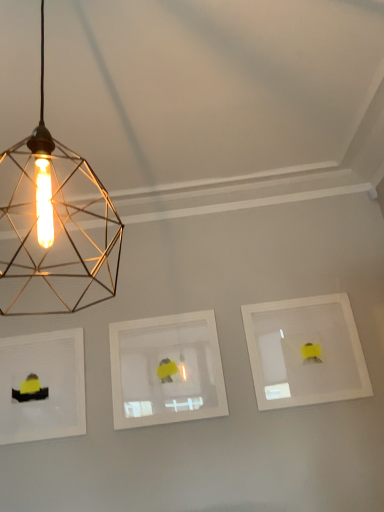
Question: In which direction should I rotate to look at white matte picture frame at center, the second picture frame in the right-to-left sequence?

Choices:
 (A) right
 (B) left

Answer: (B)

Question: Can white matte picture frame at center, the 2th picture frame in the left-to-right sequence, be found inside white matte picture frame at right, positioned as the 3th picture frame in left-to-right order?

Choices:
 (A) yes
 (B) no

Answer: (B)

Question: Can you confirm if white matte picture frame at right, acting as the first picture frame starting from the right, is smaller than white matte picture frame at center, the second picture frame in the right-to-left sequence?

Choices:
 (A) no
 (B) yes

Answer: (B)

Question: Does white matte picture frame at right, positioned as the 3th picture frame in left-to-right order, have a larger size compared to white matte picture frame at center, the 2th picture frame in the left-to-right sequence?

Choices:
 (A) yes
 (B) no

Answer: (B)

Question: Can you confirm if white matte picture frame at right, acting as the first picture frame starting from the right, is taller than white matte picture frame at center, the second picture frame in the right-to-left sequence?

Choices:
 (A) yes
 (B) no

Answer: (A)

Question: From a real-world perspective, is white matte picture frame at right, acting as the first picture frame starting from the right, physically below white matte picture frame at center, the 2th picture frame in the left-to-right sequence?

Choices:
 (A) no
 (B) yes

Answer: (A)

Question: Is white matte picture frame at right, positioned as the 3th picture frame in left-to-right order, to the left of white matte picture frame at center, the 2th picture frame in the left-to-right sequence, from the viewer's perspective?

Choices:
 (A) yes
 (B) no

Answer: (B)

Question: From the image's perspective, is matte white picture frame at left, which ranks as the 3th picture frame in right-to-left order, on top of white matte picture frame at right, positioned as the 3th picture frame in left-to-right order?

Choices:
 (A) yes
 (B) no

Answer: (B)

Question: Is matte white picture frame at left, which ranks as the 3th picture frame in right-to-left order, further to camera compared to white matte picture frame at right, acting as the first picture frame starting from the right?

Choices:
 (A) yes
 (B) no

Answer: (A)

Question: Is matte white picture frame at left, which ranks as the 3th picture frame in right-to-left order, aimed at white matte picture frame at right, positioned as the 3th picture frame in left-to-right order?

Choices:
 (A) no
 (B) yes

Answer: (A)

Question: Is white matte picture frame at right, positioned as the 3th picture frame in left-to-right order, surrounded by matte white picture frame at left, which ranks as the 3th picture frame in right-to-left order?

Choices:
 (A) yes
 (B) no

Answer: (B)

Question: Is matte white picture frame at left, which ranks as the 3th picture frame in right-to-left order, with white matte picture frame at right, positioned as the 3th picture frame in left-to-right order?

Choices:
 (A) no
 (B) yes

Answer: (A)

Question: Would you consider matte white picture frame at left, which ranks as the 3th picture frame in right-to-left order, to be distant from white matte picture frame at right, acting as the first picture frame starting from the right?

Choices:
 (A) yes
 (B) no

Answer: (A)

Question: Does gold wire mesh light bulb at upper left contain matte white picture frame at left, which ranks as the 3th picture frame in right-to-left order?

Choices:
 (A) yes
 (B) no

Answer: (B)